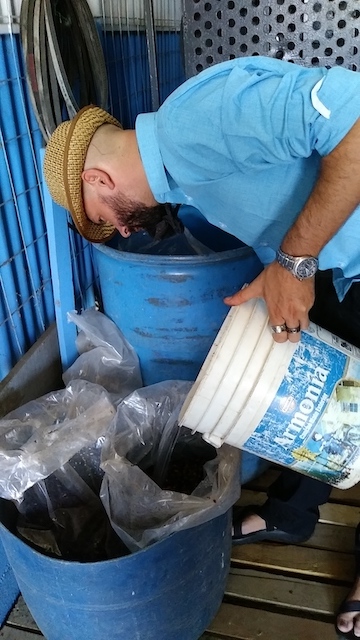
I want to click on plastic wall, so click(x=18, y=271).